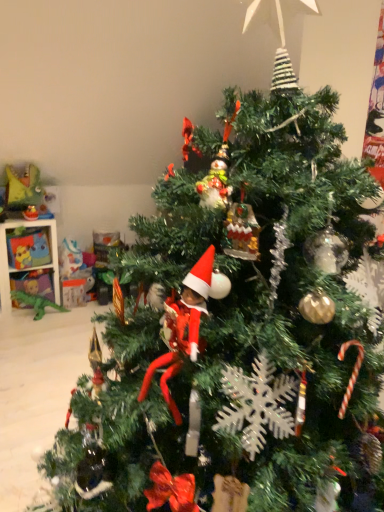
Question: From the image's perspective, is matte yellow toy at upper left, placed as the 2th toy when sorted from top to bottom, positioned above or below green plastic dinosaur at left, the third toy in the top-to-bottom sequence?

Choices:
 (A) above
 (B) below

Answer: (A)

Question: Based on their positions, is matte yellow toy at upper left, placed as the 2th toy when sorted from top to bottom, located to the left or right of green plastic dinosaur at left, marked as the 1th toy in a bottom-to-top arrangement?

Choices:
 (A) right
 (B) left

Answer: (B)

Question: Which is nearer to the green plastic dinosaur at left, marked as the 1th toy in a bottom-to-top arrangement?

Choices:
 (A) matte yellow plush toy at left, which appears as the 1th toy when viewed from the top
 (B) matte plastic toy at left
 (C) matte yellow toy at upper left, placed as the 2th toy when sorted from top to bottom

Answer: (B)

Question: Estimate the real-world distances between objects in this image. Which object is farther from the matte yellow toy at upper left, arranged as the 2th toy when ordered from the bottom?

Choices:
 (A) matte yellow plush toy at left, which appears as the 1th toy when viewed from the top
 (B) matte plastic toy at left
 (C) green plastic dinosaur at left, marked as the 1th toy in a bottom-to-top arrangement

Answer: (C)